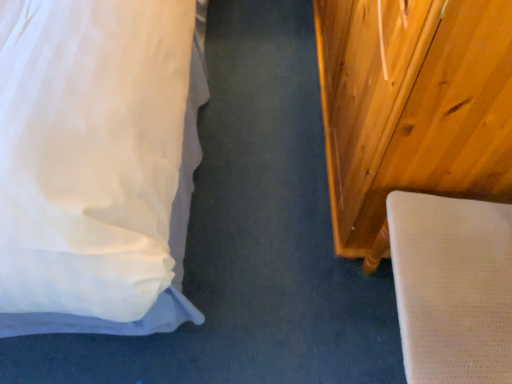
Describe the element at coordinates (412, 108) in the screenshot. The image size is (512, 384). I see `white foam mattress at right` at that location.

Image resolution: width=512 pixels, height=384 pixels. I want to click on white foam mattress at right, so click(x=412, y=108).

Where is `white foam mattress at right`? white foam mattress at right is located at coordinates (412, 108).